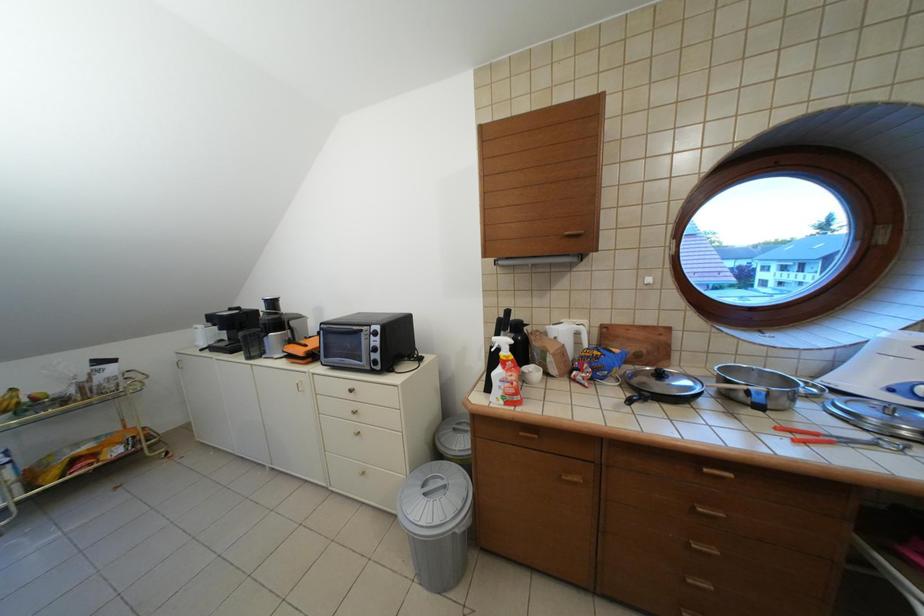
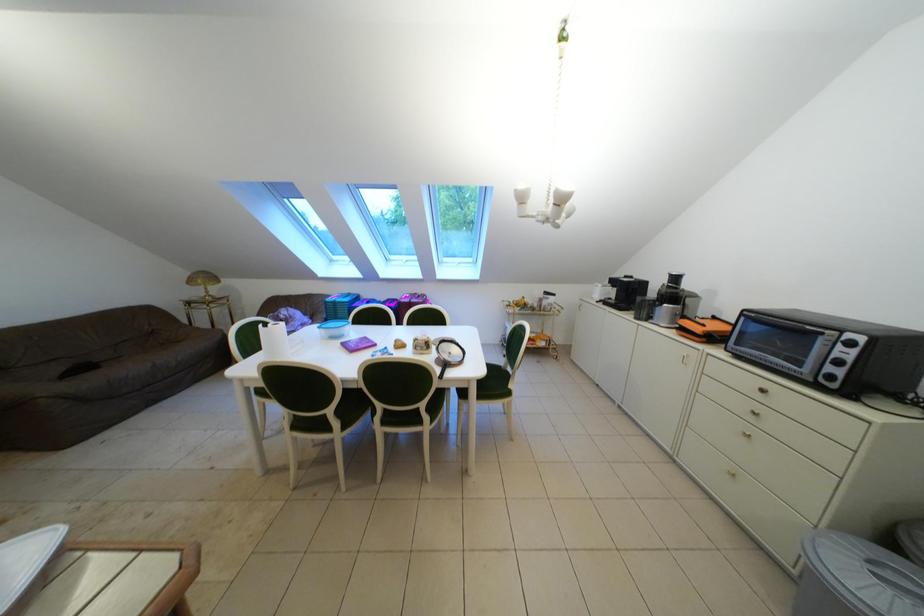
Question: The camera is either moving clockwise (left) or counter-clockwise (right) around the object. The first image is from the beginning of the video and the second image is from the end. Is the camera moving left or right when shooting the video?

Choices:
 (A) Left
 (B) Right

Answer: (B)